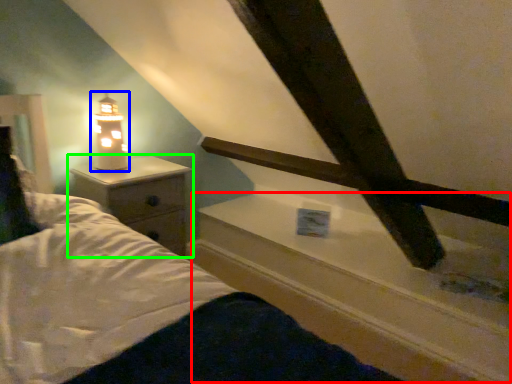
Question: Considering the real-world distances, which object is closest to window sill (highlighted by a red box)? lamp (highlighted by a blue box) or nightstand (highlighted by a green box).

Choices:
 (A) lamp
 (B) nightstand

Answer: (B)